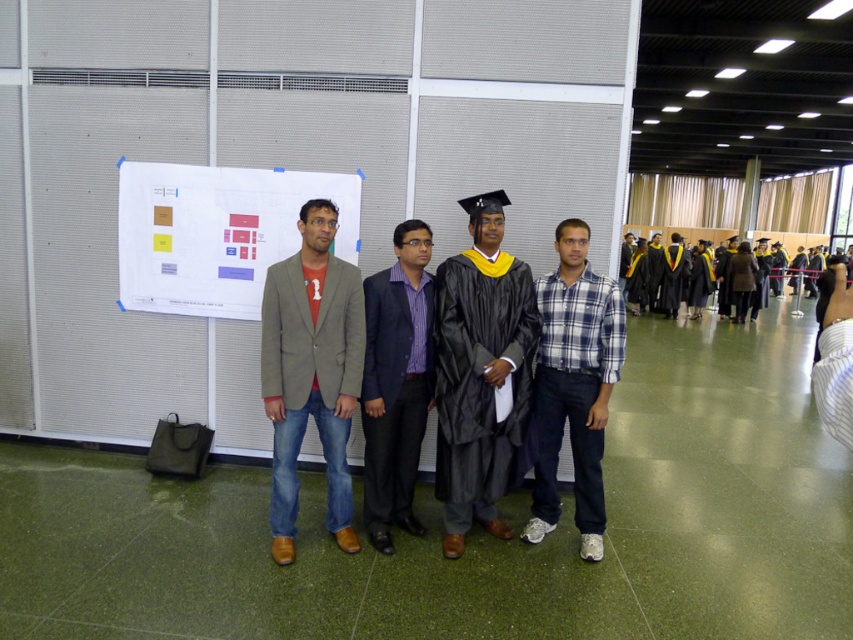
You are organizing a photo shoot and need to arrange the matte gray blazer at center and the blue plaid shirt at center in a way that they are both visible in the frame. Given their sizes, which clothing item should you place closer to the camera to ensure both are fully visible?

The matte gray blazer at center occupies less space than the blue plaid shirt at center, so you should place the blue plaid shirt at center closer to the camera to ensure both are fully visible.

You are standing at the back of the auditorium and want to take a photo of two points marked on the floor. The first point is at coordinates point (340, 406) and the second point is at point (618, 336). Which point will appear larger in your photo?

Point (340, 406) is closer to the camera than point (618, 336), so it will appear larger in the photo.

You are a photographer positioned at the back of the auditorium. You need to capture a photo that includes both the white paper at upper center and the blue plaid shirt at center. Which object should you adjust your camera focus on first to ensure both are in focus?

You should focus on the blue plaid shirt at center first because it is closer to the camera than the white paper at upper center, which is further away. By focusing on the closer object, the depth of field will naturally include the farther object in focus as well.